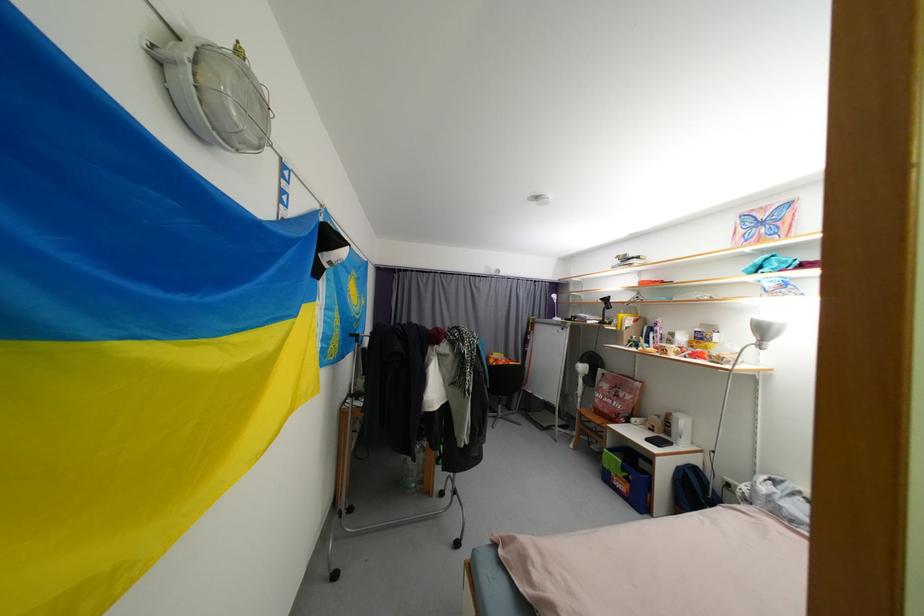
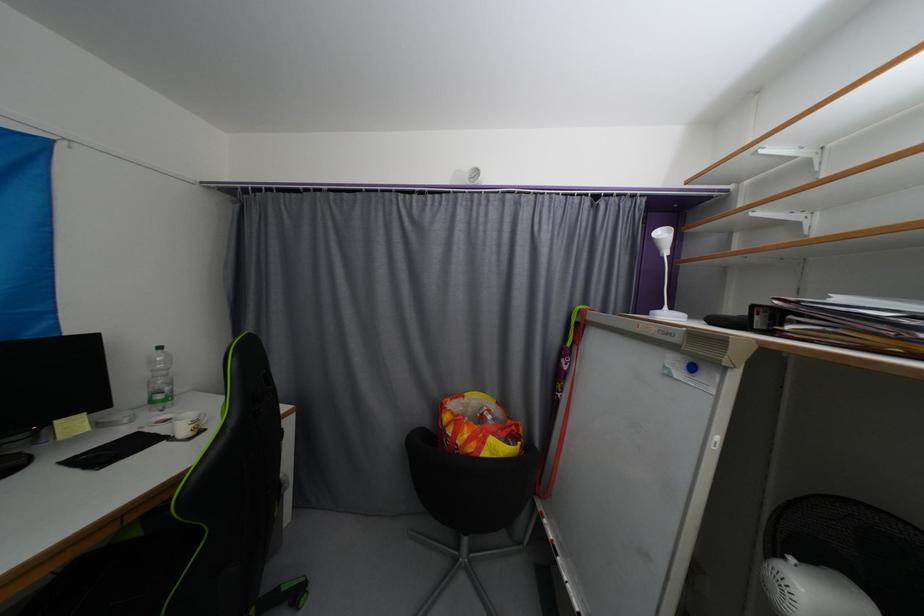
Locate, in the second image, the point that corresponds to pixel 496 363 in the first image.

(452, 419)